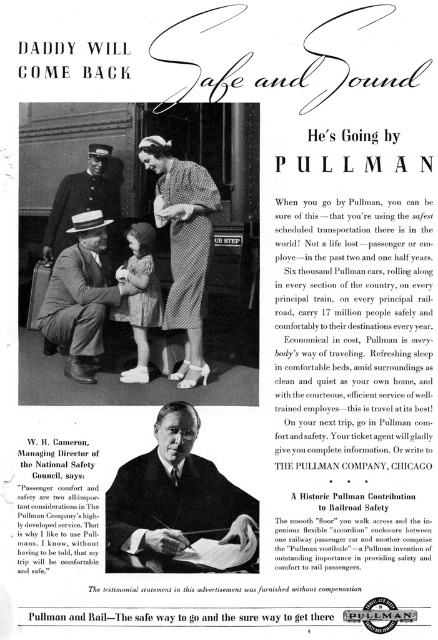
Can you confirm if matte black suit at center is positioned below pastel pink dress at center?

Actually, matte black suit at center is above pastel pink dress at center.

Is matte black suit at center bigger than pastel pink dress at center?

Yes, matte black suit at center is bigger than pastel pink dress at center.

At what (x,y) coordinates should I click in order to perform the action: click on matte black suit at center. Please return your answer as a coordinate pair (x, y). Looking at the image, I should click on (81, 298).

Where is `matte black suit at center`? Image resolution: width=438 pixels, height=640 pixels. matte black suit at center is located at coordinates [x=81, y=298].

Who is lower down, smooth black suit at center or uniformed man at center?

smooth black suit at center is below.

Is point (129, 460) positioned in front of point (95, 145)?

Yes, it is in front of point (95, 145).

What do you see at coordinates (176, 506) in the screenshot? I see `smooth black suit at center` at bounding box center [176, 506].

The image size is (438, 640). Find the location of `smooth black suit at center`. smooth black suit at center is located at coordinates 176,506.

Is smooth black suit at center below matte black suit at center?

Correct, smooth black suit at center is located below matte black suit at center.

Does smooth black suit at center appear on the left side of matte black suit at center?

In fact, smooth black suit at center is to the right of matte black suit at center.

Is point (182, 570) in front of point (73, 252)?

Yes, it is in front of point (73, 252).

The width and height of the screenshot is (438, 640). I want to click on smooth black suit at center, so click(x=176, y=506).